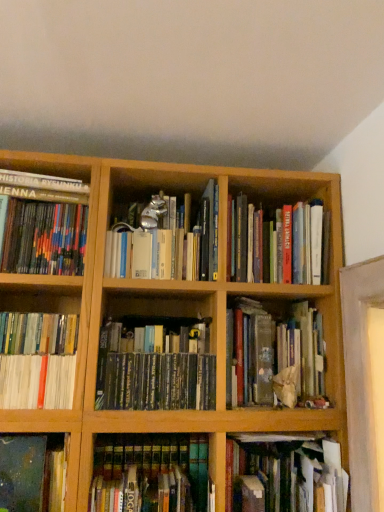
Question: Based on their sizes in the image, would you say hardcover books at center, placed as the 8th book when sorted from left to right, is bigger or smaller than hardcover book at lower center, the 7th book in the left-to-right sequence?

Choices:
 (A) small
 (B) big

Answer: (B)

Question: Considering the positions of point (289, 281) and point (233, 500), is point (289, 281) closer or farther from the camera than point (233, 500)?

Choices:
 (A) closer
 (B) farther

Answer: (B)

Question: Estimate the real-world distances between objects in this image. Which object is farther from the hardcover book at lower center, which is counted as the third book, starting from the right?

Choices:
 (A) multicolored hardcover books at left, the 9th book from the right
 (B) hardcover books at center, placed as the fifth book when sorted from right to left
 (C) hardcover books at center, the second book viewed from the right
 (D) green matte book at center, which is counted as the 6th book, starting from the right
 (E) green matte book at center, the 9th book in the left-to-right sequence

Answer: (A)

Question: Based on their relative distances, which object is farther from the hardcover books at center, the second book viewed from the right?

Choices:
 (A) multicolored hardcover books at left, the 9th book from the right
 (B) hardcover book at lower center, the 7th book in the left-to-right sequence
 (C) hardcover books at center, placed as the fifth book when sorted from right to left
 (D) green matte book at center, which is counted as the 6th book, starting from the right
 (E) green matte book at center, the 1th book positioned from the right

Answer: (C)